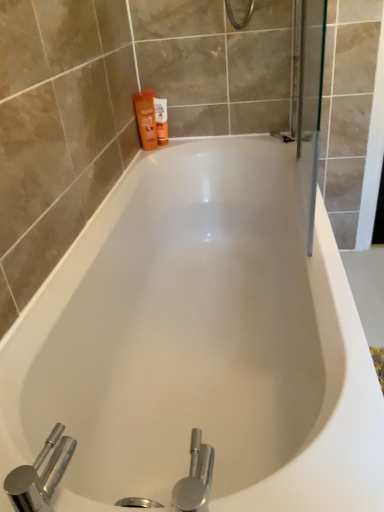
Question: From the image's perspective, is white glossy bathtub at center above chrome metallic faucet at lower left?

Choices:
 (A) yes
 (B) no

Answer: (A)

Question: Is white glossy bathtub at center not near chrome metallic faucet at lower left?

Choices:
 (A) no
 (B) yes

Answer: (A)

Question: Is white glossy bathtub at center turned away from chrome metallic faucet at lower left?

Choices:
 (A) no
 (B) yes

Answer: (A)

Question: Does white glossy bathtub at center lie in front of chrome metallic faucet at lower left?

Choices:
 (A) yes
 (B) no

Answer: (B)

Question: From a real-world perspective, is white glossy bathtub at center below chrome metallic faucet at lower left?

Choices:
 (A) no
 (B) yes

Answer: (B)

Question: Is chrome metallic faucet at lower left surrounded by white glossy bathtub at center?

Choices:
 (A) no
 (B) yes

Answer: (A)

Question: Would you say chrome metallic faucet at lower left is a long distance from orange matte bottle at upper left, placed as the 1th toiletry when sorted from left to right?

Choices:
 (A) yes
 (B) no

Answer: (A)

Question: Is chrome metallic faucet at lower left smaller than orange matte bottle at upper left, placed as the 1th toiletry when sorted from left to right?

Choices:
 (A) no
 (B) yes

Answer: (B)

Question: From a real-world perspective, is chrome metallic faucet at lower left positioned over orange matte bottle at upper left, placed as the 1th toiletry when sorted from left to right, based on gravity?

Choices:
 (A) no
 (B) yes

Answer: (A)

Question: Is chrome metallic faucet at lower left positioned with its back to orange matte bottle at upper left, placed as the 1th toiletry when sorted from left to right?

Choices:
 (A) yes
 (B) no

Answer: (B)

Question: Can you confirm if chrome metallic faucet at lower left is bigger than orange matte bottle at upper left, which is the 2th toiletry in right-to-left order?

Choices:
 (A) no
 (B) yes

Answer: (A)

Question: Can you confirm if chrome metallic faucet at lower left is thinner than orange matte bottle at upper left, placed as the 1th toiletry when sorted from left to right?

Choices:
 (A) yes
 (B) no

Answer: (B)

Question: Is orange matte bottle at upper left, which is the 2th toiletry in right-to-left order, outside of orange matte lotion at upper left, which is the first toiletry from right to left?

Choices:
 (A) yes
 (B) no

Answer: (A)